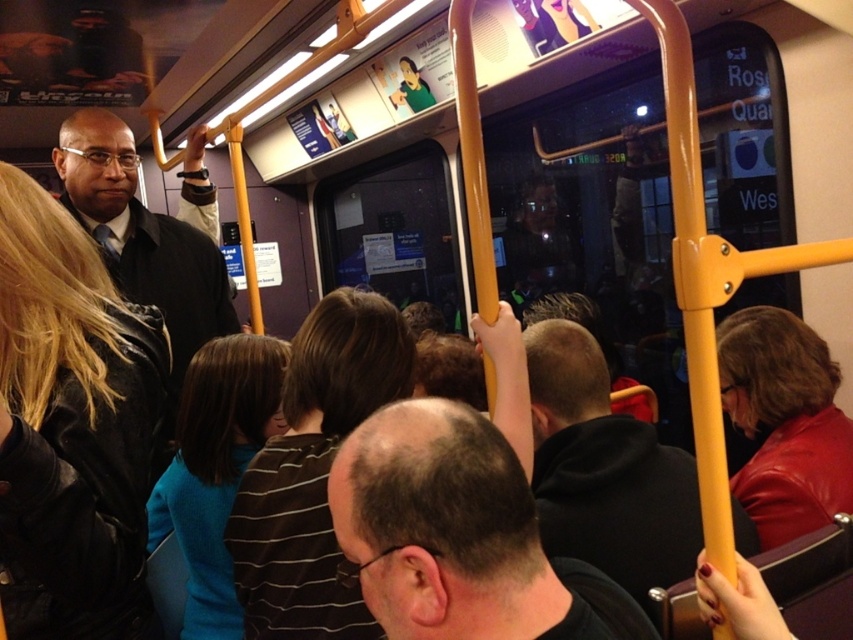
Question: Observing the image, what is the correct spatial positioning of black leather jacket at left in reference to black hoodie at center?

Choices:
 (A) left
 (B) right

Answer: (A)

Question: Which of the following is the farthest from the observer?

Choices:
 (A) dark brown hair at center
 (B) black leather jacket at left
 (C) matte black suit at left
 (D) shiny red leather jacket at right

Answer: (C)

Question: Is black leather jacket at left positioned behind matte black suit at left?

Choices:
 (A) yes
 (B) no

Answer: (B)

Question: Which point is closer to the camera?

Choices:
 (A) tap(561, 515)
 (B) tap(113, 173)
 (C) tap(352, 320)
 (D) tap(469, 518)

Answer: (D)

Question: Is black leather jacket at left positioned at the back of striped shirt at center?

Choices:
 (A) yes
 (B) no

Answer: (B)

Question: Which of these objects is positioned farthest from the striped shirt at center?

Choices:
 (A) matte black suit at left
 (B) black hoodie at center
 (C) shiny red leather jacket at right

Answer: (A)